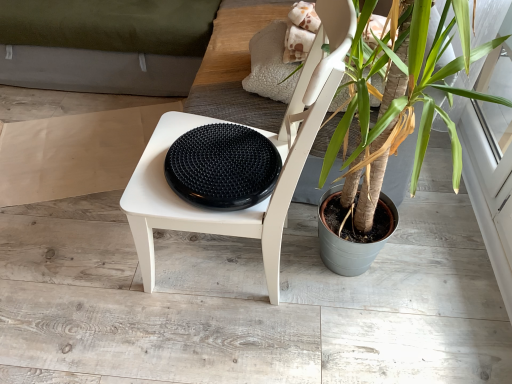
Identify the location of unoccupied area in front of white matte chair at center. (215, 346).